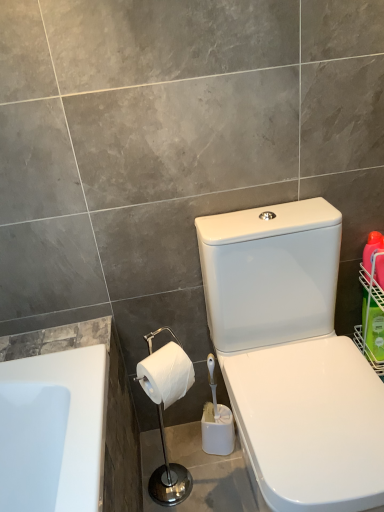
Question: Choose the correct answer: Is green plastic basket at right inside white glossy toilet paper holder at lower left or outside it?

Choices:
 (A) outside
 (B) inside

Answer: (A)

Question: Based on their sizes in the image, would you say green plastic basket at right is bigger or smaller than white glossy toilet paper holder at lower left?

Choices:
 (A) small
 (B) big

Answer: (A)

Question: Based on their relative distances, which object is nearer to the white glossy toilet paper holder at lower left?

Choices:
 (A) green plastic basket at right
 (B) white glossy toilet at center-right
 (C) white matte toilet paper at lower center
 (D) bright orange plastic bottle at right

Answer: (C)

Question: Which object is positioned closest to the white glossy toilet paper holder at lower left?

Choices:
 (A) green plastic basket at right
 (B) bright orange plastic bottle at right
 (C) white glossy toilet at center-right
 (D) white matte toilet paper at lower center

Answer: (D)